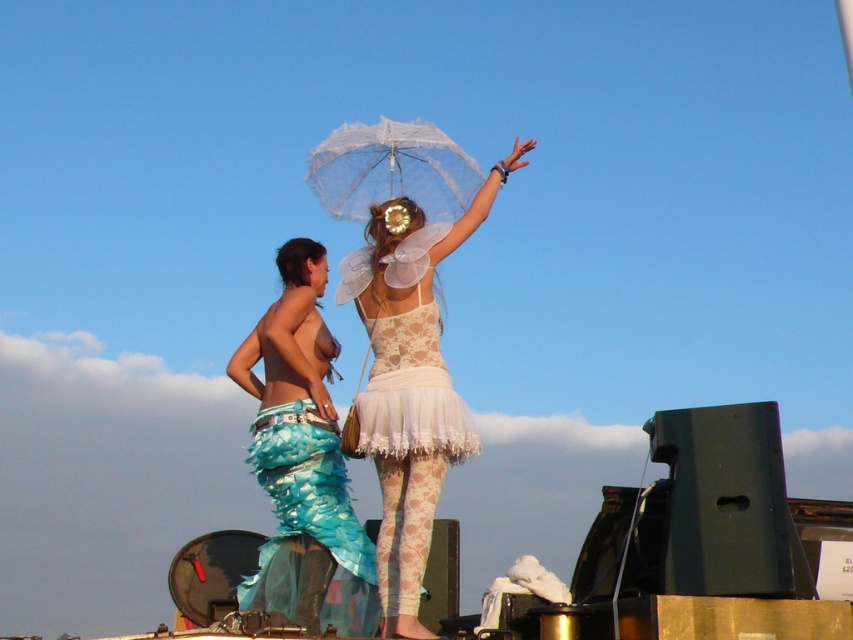
Who is positioned more to the left, lace fabric tutu at center or teal fabric mermaid tail at lower left?

teal fabric mermaid tail at lower left is more to the left.

Who is higher up, lace fabric tutu at center or teal fabric mermaid tail at lower left?

lace fabric tutu at center is above.

Between point (386, 490) and point (340, 509), which one is positioned in front?

Point (386, 490) is in front.

You are a GUI agent. You are given a task and a screenshot of the screen. Output one action in this format:
    pyautogui.click(x=<x>, y=<y>)
    Task: Click on the lace fabric tutu at center
    This screenshot has width=853, height=640.
    Given the screenshot: What is the action you would take?
    pyautogui.click(x=409, y=384)

From the picture: Which is more to the right, teal fabric mermaid tail at lower left or lace/sheer white dress at center?

lace/sheer white dress at center is more to the right.

At what (x,y) coordinates should I click in order to perform the action: click on teal fabric mermaid tail at lower left. Please return your answer as a coordinate pair (x, y). Looking at the image, I should click on (303, 461).

The width and height of the screenshot is (853, 640). What are the coordinates of `teal fabric mermaid tail at lower left` in the screenshot? It's located at (303, 461).

Which is below, lace fabric tutu at center or transparent lace umbrella at center?

lace fabric tutu at center

Who is shorter, lace fabric tutu at center or transparent lace umbrella at center?

Standing shorter between the two is transparent lace umbrella at center.

Who is more distant from viewer, (462, 412) or (428, 186)?

Positioned behind is point (428, 186).

Locate an element on the screen. Image resolution: width=853 pixels, height=640 pixels. lace fabric tutu at center is located at coordinates (409, 384).